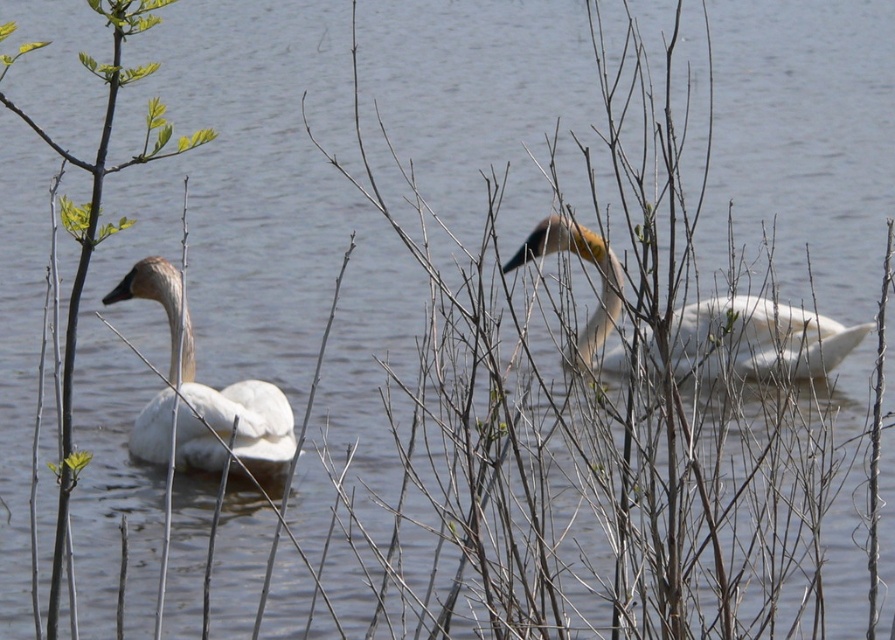
You are observing two white matte swans in a serene pond scene. The foreground has branches that partially obscure the view. Which swan, the white matte swan at center or the white matte swan at left, appears nearer to you?

The white matte swan at center is closer to the viewer than the white matte swan at left.

You are standing on the lakeside and see the white matte swan at left and the green leafy branch at left. Which object is closer to you?

The white matte swan at left is closer to you because it is further to the viewer than the green leafy branch at left.

You are an ornithologist observing the scene. You notice the white matte swan at left and the green leafy branch at left. Which object is closer to the water surface?

The white matte swan at left is below the green leafy branch at left, so the swan is closer to the water surface than the branch.